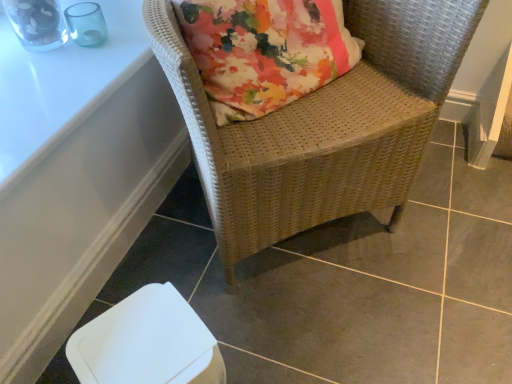
At what (x,y) coordinates should I click in order to perform the action: click on unoccupied space behind white plastic swivel chair at lower left. Please return your answer as a coordinate pair (x, y). The image size is (512, 384). Looking at the image, I should click on (209, 301).